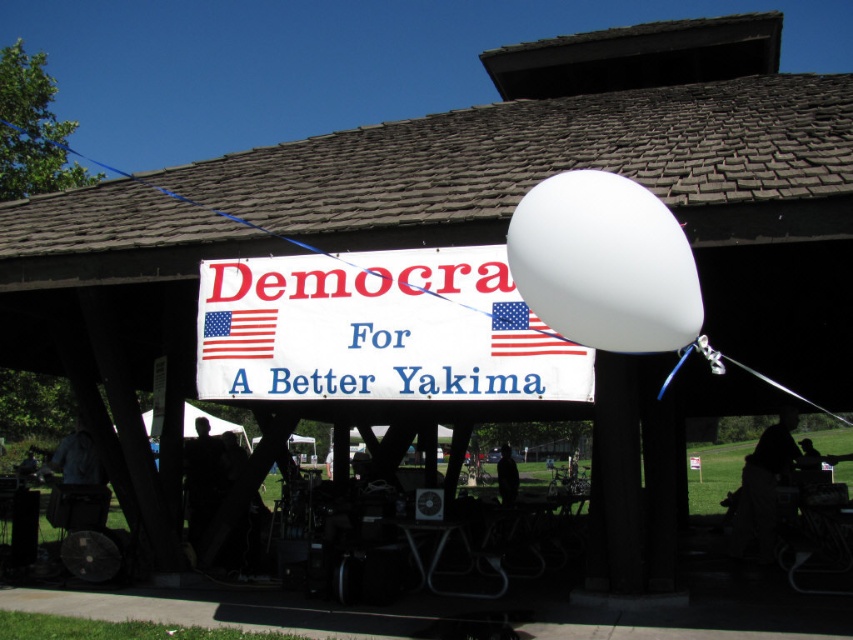
Does white paper sign at center have a lesser width compared to american flag at center?

No.

Does point (517, 310) come closer to viewer compared to point (529, 349)?

No, it is behind (529, 349).

Identify the location of white paper sign at center. (379, 330).